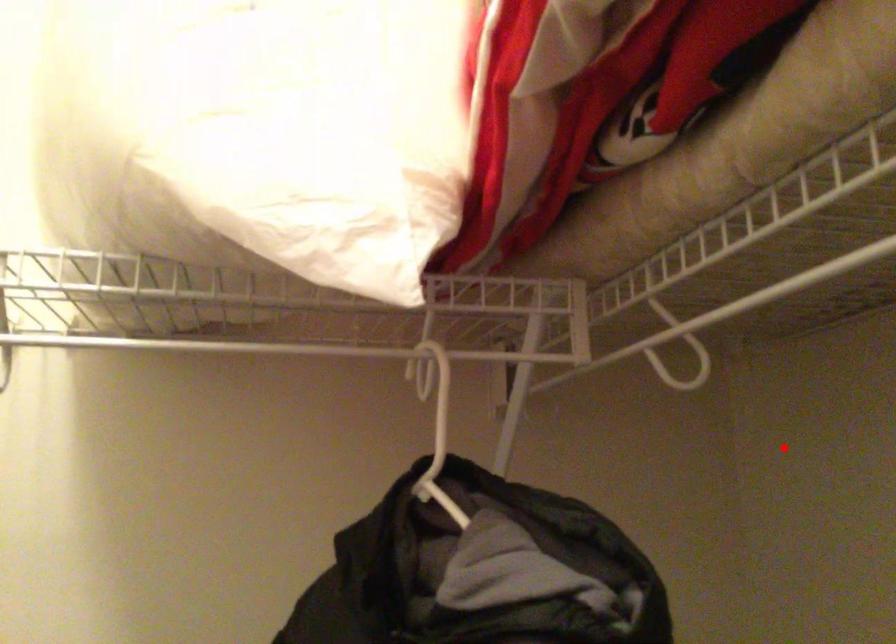
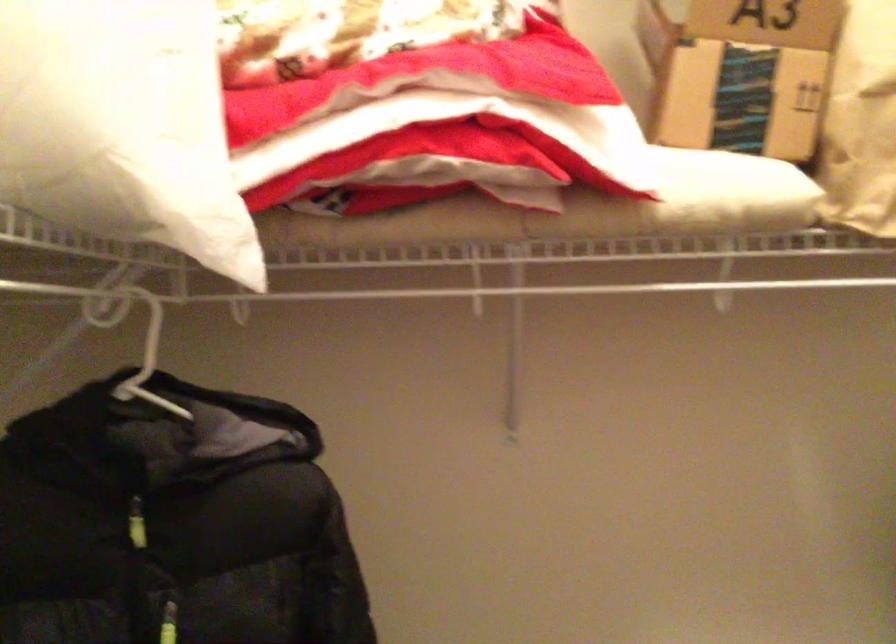
The point at the highlighted location is marked in the first image. Where is the corresponding point in the second image?

(138, 344)